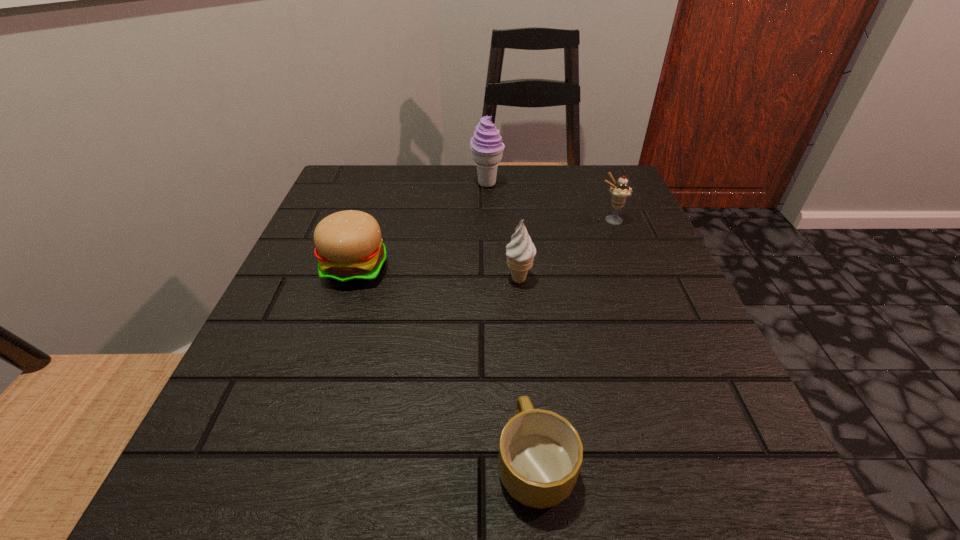
Where is `vacant space at the near edge`? Image resolution: width=960 pixels, height=540 pixels. vacant space at the near edge is located at coordinates (585, 485).

The image size is (960, 540). I want to click on free space at the left edge of the desktop, so click(x=270, y=431).

The width and height of the screenshot is (960, 540). Find the location of `free space at the right edge`. free space at the right edge is located at coordinates (601, 286).

The height and width of the screenshot is (540, 960). Identify the location of vacant space at the near left corner. (224, 496).

At what (x,y) coordinates should I click in order to perform the action: click on free region at the far right corner of the desktop. Please return your answer as a coordinate pair (x, y). This screenshot has width=960, height=540. Looking at the image, I should click on (576, 166).

Locate an element on the screen. The image size is (960, 540). vacant area that lies between the nearest icecream and the leftmost object is located at coordinates (438, 274).

Locate an element on the screen. Image resolution: width=960 pixels, height=540 pixels. empty space between the nearest icecream and the mug is located at coordinates (527, 371).

You are a GUI agent. You are given a task and a screenshot of the screen. Output one action in this format:
    pyautogui.click(x=<x>, y=<y>)
    Task: Click on the vacant area that lies between the nearest icecream and the fourth nearest object
    
    Given the screenshot: What is the action you would take?
    pyautogui.click(x=564, y=250)

Identify the location of empty space that is in between the nearest icecream and the farthest icecream. 503,232.

Locate an element on the screen. The height and width of the screenshot is (540, 960). free space between the nearest object and the nearest icecream is located at coordinates (527, 371).